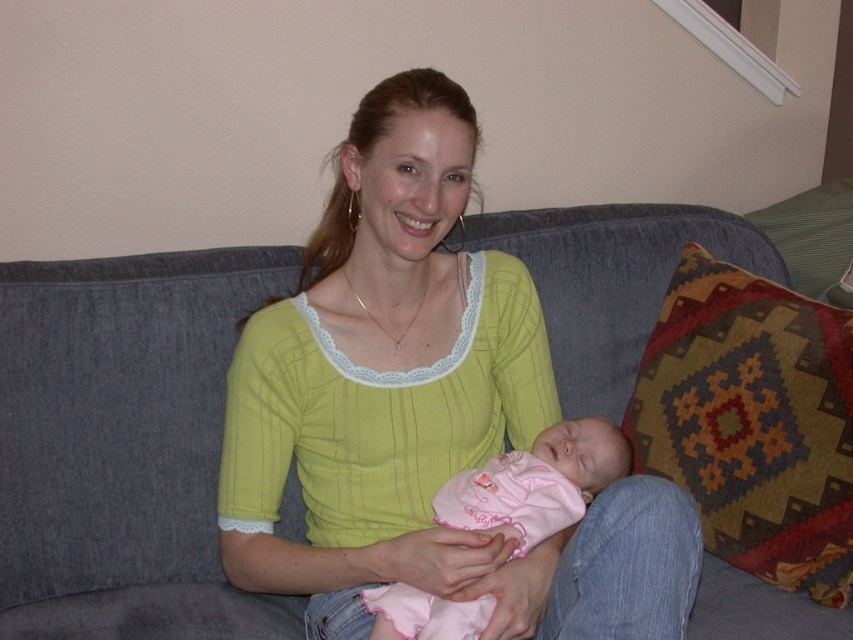
You are a photographer setting up for a family photo shoot. You need to position a small stool to the right of the gray fabric couch at center so that it is directly behind the pink fabric baby at center. Is this possible given their current positions?

The gray fabric couch at center is positioned on the left side of pink fabric baby at center. Therefore, placing the stool to the right of the gray fabric couch at center would naturally place it behind the pink fabric baby at center, making this arrangement possible.

You are a photographer setting up for a family portrait. You need to position a small decorative item to the right of the pink fabric baby at center so it appears in the frame. Is the multicolored woven pillow at right already positioned correctly for this requirement?

Yes, the multicolored woven pillow at right is already positioned to the right of the pink fabric baby at center, so it meets the requirement.

You are a photographer standing in front of the gray fabric couch at center and the pink fabric baby at center. You want to take a photo of the baby without the couch being in the frame. Is the baby positioned in a way that allows you to do this?

The gray fabric couch at center is positioned over the pink fabric baby at center, so the couch is blocking the baby. You will need to adjust your angle or move the couch to capture the baby without the couch in the frame.